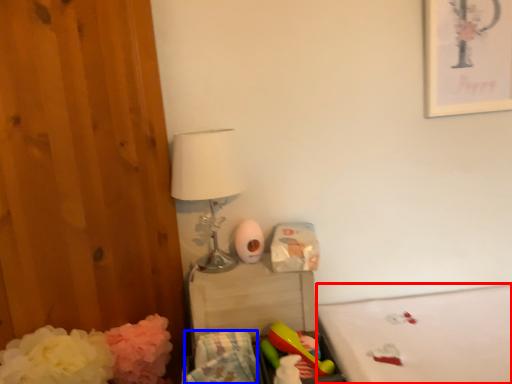
Question: Which of the following is the closest to the observer, mattress (highlighted by a red box) or material (highlighted by a blue box)?

Choices:
 (A) mattress
 (B) material

Answer: (B)